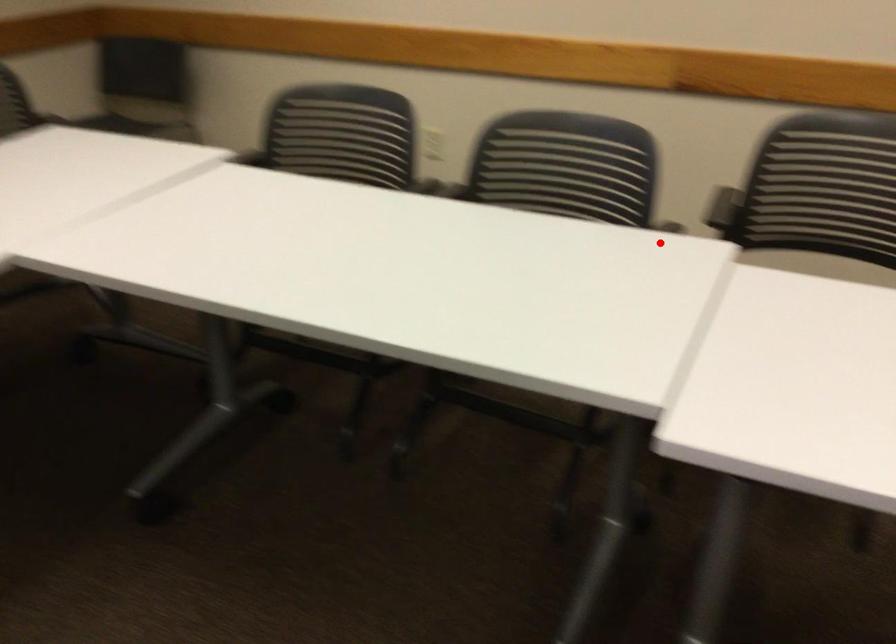
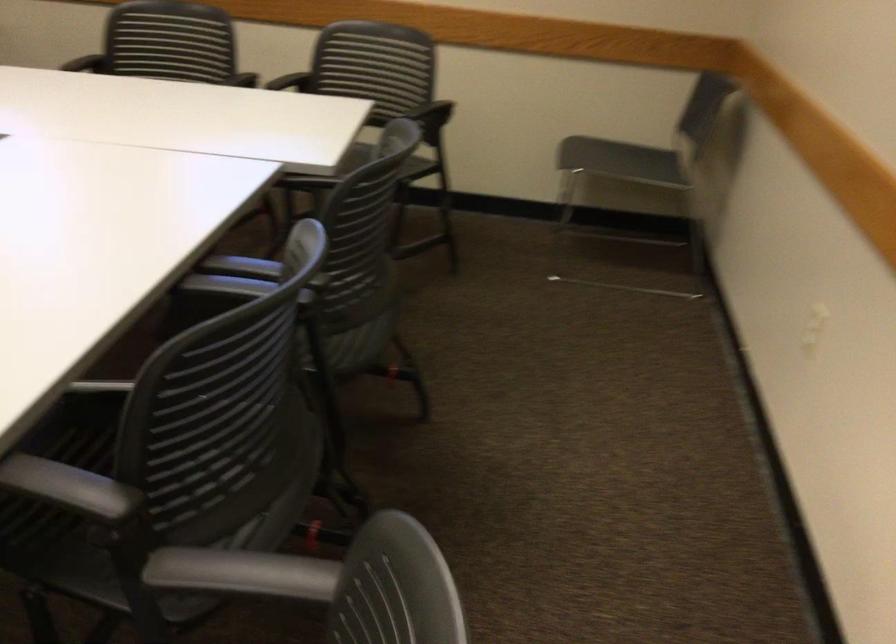
Question: I am providing you with two images of the same scene from different viewpoints. A red point is shown in image1. For the corresponding object point in image2, is it positioned nearer or farther from the camera?

Choices:
 (A) Nearer
 (B) Farther

Answer: (A)